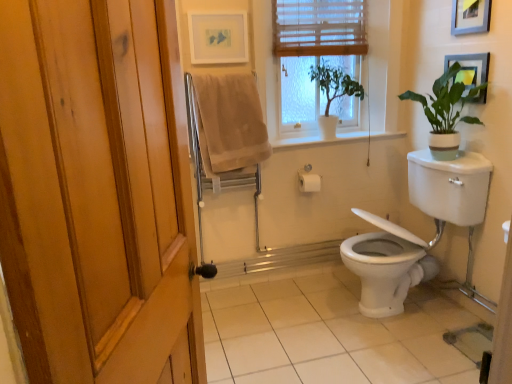
This screenshot has width=512, height=384. What do you see at coordinates (447, 200) in the screenshot?
I see `white glossy toilet at lower right` at bounding box center [447, 200].

Locate an element on the screen. The width and height of the screenshot is (512, 384). green matte plant at upper center, acting as the 1th houseplant starting from the left is located at coordinates (333, 93).

The height and width of the screenshot is (384, 512). Identify the location of green matte plant at upper right, the second houseplant when ordered from left to right. (446, 112).

Where is `wooden picture frame at upper right, the 2th picture frame in the right-to-left sequence`? The image size is (512, 384). wooden picture frame at upper right, the 2th picture frame in the right-to-left sequence is located at coordinates (470, 16).

Is white tile at lower center in front of or behind matte white picture frame at upper center, which is the first picture frame from left to right, in the image?

Visually, white tile at lower center is located in front of matte white picture frame at upper center, which is the first picture frame from left to right.

Is white tile at lower center far away from matte white picture frame at upper center, the 3th picture frame when ordered from right to left?

Absolutely, white tile at lower center is distant from matte white picture frame at upper center, the 3th picture frame when ordered from right to left.

How far apart are white tile at lower center and matte white picture frame at upper center, the 3th picture frame when ordered from right to left?

white tile at lower center and matte white picture frame at upper center, the 3th picture frame when ordered from right to left, are 5.31 feet apart.

From a real-world perspective, which object rests below the other?

white tile at lower center.

Can you tell me how much green matte plant at upper right, the second houseplant when ordered from left to right, and metallic silver picture frame at upper right, acting as the 1th picture frame starting from the right, differ in facing direction?

0.337 degrees.

In terms of height, does green matte plant at upper right, which appears as the 1th houseplant when viewed from the right, look taller or shorter compared to metallic silver picture frame at upper right, acting as the 1th picture frame starting from the right?

Considering their sizes, green matte plant at upper right, which appears as the 1th houseplant when viewed from the right, has more height than metallic silver picture frame at upper right, acting as the 1th picture frame starting from the right.

Is green matte plant at upper right, the second houseplant when ordered from left to right, next to metallic silver picture frame at upper right, which is the third picture frame in left-to-right order?

They are not placed beside each other.

There is a metallic silver picture frame at upper right, acting as the 1th picture frame starting from the right. Where is `the 2nd houseplant below it (from the image's perspective)`? the 2nd houseplant below it (from the image's perspective) is located at coordinates (446, 112).

Is wooden blinds at upper center oriented away from beige cotton towel at upper center?

No, wooden blinds at upper center's orientation is not away from beige cotton towel at upper center.

Locate an element on the screen. Image resolution: width=512 pixels, height=384 pixels. bath towel in front of the wooden blinds at upper center is located at coordinates (229, 124).

Considering the sizes of wooden blinds at upper center and beige cotton towel at upper center in the image, is wooden blinds at upper center taller or shorter than beige cotton towel at upper center?

Considering their sizes, wooden blinds at upper center has more height than beige cotton towel at upper center.

Based on the photo, from the image's perspective, who appears lower, wooden blinds at upper center or beige cotton towel at upper center?

From the image's view, beige cotton towel at upper center is below.

Is point (474, 23) behind point (334, 26)?

No.

Is wooden picture frame at upper right, which is the 2th picture frame from left to right, aimed at wooden blinds at upper center?

No.

Is wooden picture frame at upper right, which is the 2th picture frame from left to right, to the right of wooden blinds at upper center from the viewer's perspective?

Indeed, wooden picture frame at upper right, which is the 2th picture frame from left to right, is positioned on the right side of wooden blinds at upper center.

Based on the photo, from the image's perspective, is matte white picture frame at upper center, which is the first picture frame from left to right, above or below metallic silver picture frame at upper right, which is the third picture frame in left-to-right order?

Based on their image positions, matte white picture frame at upper center, which is the first picture frame from left to right, is located above metallic silver picture frame at upper right, which is the third picture frame in left-to-right order.

Is matte white picture frame at upper center, which is the first picture frame from left to right, oriented away from metallic silver picture frame at upper right, which is the third picture frame in left-to-right order?

matte white picture frame at upper center, which is the first picture frame from left to right, does not have its back to metallic silver picture frame at upper right, which is the third picture frame in left-to-right order.

How different are the orientations of matte white picture frame at upper center, the 3th picture frame when ordered from right to left, and metallic silver picture frame at upper right, acting as the 1th picture frame starting from the right, in degrees?

The angular difference between matte white picture frame at upper center, the 3th picture frame when ordered from right to left, and metallic silver picture frame at upper right, acting as the 1th picture frame starting from the right, is 87.8 degrees.

Is matte white picture frame at upper center, which is the first picture frame from left to right, positioned far away from metallic silver picture frame at upper right, which is the third picture frame in left-to-right order?

Yes, matte white picture frame at upper center, which is the first picture frame from left to right, is far from metallic silver picture frame at upper right, which is the third picture frame in left-to-right order.

Which object is wider, wooden blinds at upper center or matte white picture frame at upper center, which is the first picture frame from left to right?

wooden blinds at upper center is wider.

Where is `the 1st picture frame above the wooden blinds at upper center (from the image's perspective)`? The height and width of the screenshot is (384, 512). the 1st picture frame above the wooden blinds at upper center (from the image's perspective) is located at coordinates (218, 37).

Looking at this image, from a real-world perspective, between wooden blinds at upper center and matte white picture frame at upper center, which is the first picture frame from left to right, who is vertically lower?

From a 3D spatial view, wooden blinds at upper center is below.

Between wooden blinds at upper center and matte white picture frame at upper center, the 3th picture frame when ordered from right to left, which one appears on the right side from the viewer's perspective?

From the viewer's perspective, wooden blinds at upper center appears more on the right side.

Does metallic silver picture frame at upper right, which is the third picture frame in left-to-right order, turn towards wooden picture frame at upper right, which is the 2th picture frame from left to right?

No, metallic silver picture frame at upper right, which is the third picture frame in left-to-right order, is not aimed at wooden picture frame at upper right, which is the 2th picture frame from left to right.

Is metallic silver picture frame at upper right, which is the third picture frame in left-to-right order, far away from wooden picture frame at upper right, which is the 2th picture frame from left to right?

metallic silver picture frame at upper right, which is the third picture frame in left-to-right order, is actually quite close to wooden picture frame at upper right, which is the 2th picture frame from left to right.

Consider the image. Considering the sizes of objects metallic silver picture frame at upper right, which is the third picture frame in left-to-right order, and wooden picture frame at upper right, the 2th picture frame in the right-to-left sequence, in the image provided, who is bigger, metallic silver picture frame at upper right, which is the third picture frame in left-to-right order, or wooden picture frame at upper right, the 2th picture frame in the right-to-left sequence,?

Bigger between the two is wooden picture frame at upper right, the 2th picture frame in the right-to-left sequence.

Between metallic silver picture frame at upper right, acting as the 1th picture frame starting from the right, and wooden picture frame at upper right, which is the 2th picture frame from left to right, which one is positioned behind?

metallic silver picture frame at upper right, acting as the 1th picture frame starting from the right, is behind.

At what (x,y) coordinates should I click in order to perform the action: click on the 3rd picture frame behind the white tile at lower center. Please return your answer as a coordinate pair (x, y). The height and width of the screenshot is (384, 512). Looking at the image, I should click on point(218,37).

I want to click on the 1st picture frame above the green matte plant at upper right, which appears as the 1th houseplant when viewed from the right (from the image's perspective), so click(x=469, y=68).

From the image, which object appears to be nearer to metallic silver picture frame at upper right, acting as the 1th picture frame starting from the right, green matte plant at upper center, acting as the 1th houseplant starting from the left, or wooden blinds at upper center?

Among the two, green matte plant at upper center, acting as the 1th houseplant starting from the left, is located nearer to metallic silver picture frame at upper right, acting as the 1th picture frame starting from the right.

Which object lies further to the anchor point matte white picture frame at upper center, which is the first picture frame from left to right, beige cotton towel at upper center or white glossy toilet at lower right?

Among the two, white glossy toilet at lower right is located further to matte white picture frame at upper center, which is the first picture frame from left to right.

Based on their spatial positions, is wooden blinds at upper center or metallic silver picture frame at upper right, acting as the 1th picture frame starting from the right, further from wooden picture frame at upper right, the 2th picture frame in the right-to-left sequence?

Among the two, wooden blinds at upper center is located further to wooden picture frame at upper right, the 2th picture frame in the right-to-left sequence.

Estimate the real-world distances between objects in this image. Which object is closer to matte white picture frame at upper center, which is the first picture frame from left to right, wooden blinds at upper center or green matte plant at upper center, acting as the 1th houseplant starting from the left?

wooden blinds at upper center lies closer to matte white picture frame at upper center, which is the first picture frame from left to right, than the other object.

From the image, which object appears to be farther from wooden blinds at upper center, wooden blinds at upper center or metallic silver picture frame at upper right, which is the third picture frame in left-to-right order?

Based on the image, metallic silver picture frame at upper right, which is the third picture frame in left-to-right order, appears to be further to wooden blinds at upper center.

Estimate the real-world distances between objects in this image. Which object is further from green matte plant at upper right, the second houseplant when ordered from left to right, beige cotton towel at upper center or wooden picture frame at upper right, which is the 2th picture frame from left to right?

beige cotton towel at upper center.

From the image, which object appears to be farther from green matte plant at upper right, the second houseplant when ordered from left to right, wooden blinds at upper center or wooden picture frame at upper right, which is the 2th picture frame from left to right?

wooden blinds at upper center is positioned further to the anchor green matte plant at upper right, the second houseplant when ordered from left to right.

From the image, which object appears to be farther from wooden blinds at upper center, white glossy toilet at lower right or beige cotton towel at upper center?

white glossy toilet at lower right is positioned further to the anchor wooden blinds at upper center.

Find the location of a particular element. bath towel that lies between metallic silver picture frame at upper right, which is the third picture frame in left-to-right order, and white tile at lower center from top to bottom is located at coordinates (229, 124).

Where is `houseplant situated between beige cotton towel at upper center and white glossy toilet at lower right from left to right`? Image resolution: width=512 pixels, height=384 pixels. houseplant situated between beige cotton towel at upper center and white glossy toilet at lower right from left to right is located at coordinates (333, 93).

Find the location of a particular element. window between wooden blinds at upper center and white glossy toilet at lower right vertically is located at coordinates (317, 55).

Where is `blind between matte white picture frame at upper center, the 3th picture frame when ordered from right to left, and wooden blinds at upper center from left to right`? blind between matte white picture frame at upper center, the 3th picture frame when ordered from right to left, and wooden blinds at upper center from left to right is located at coordinates (319, 27).